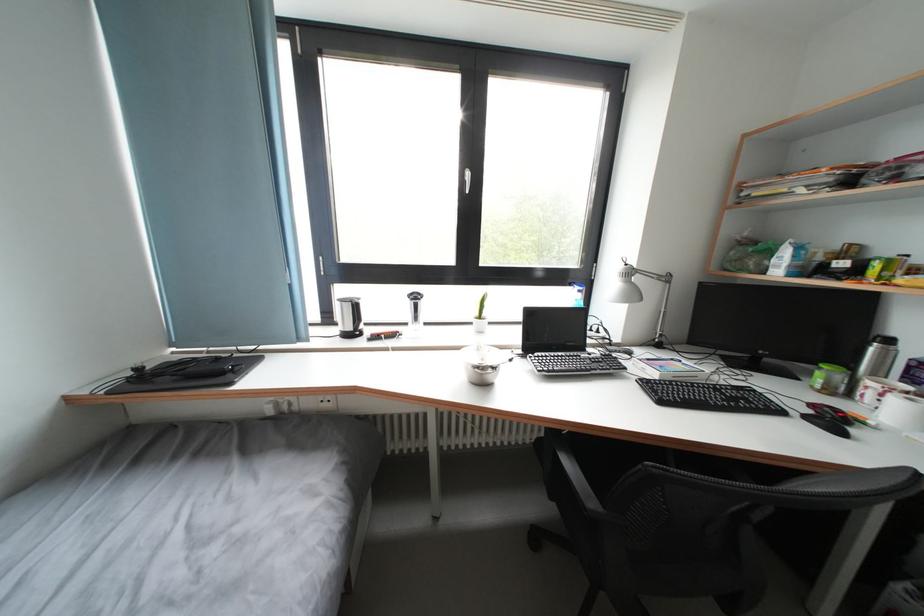
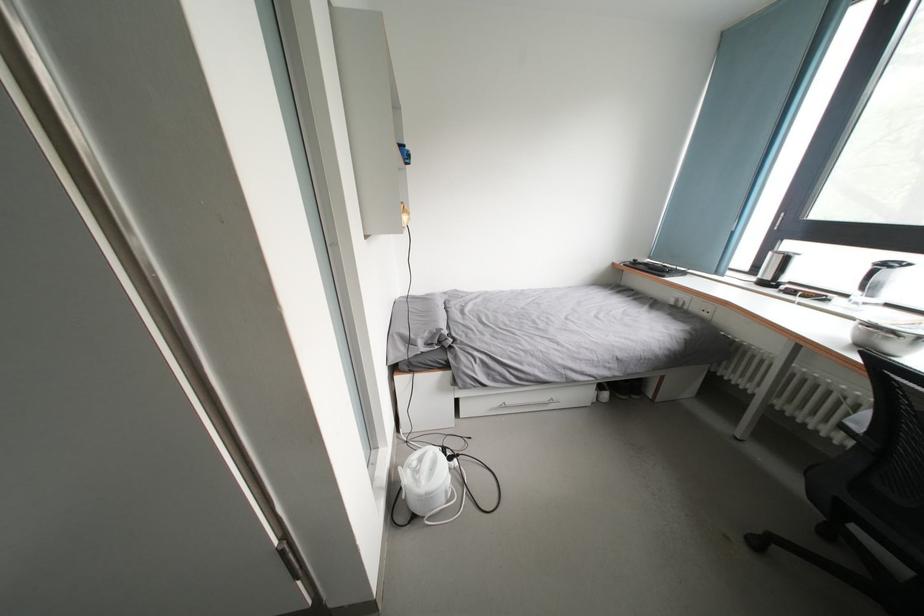
Locate, in the second image, the point that corresponds to [485,371] in the first image.

(877, 331)